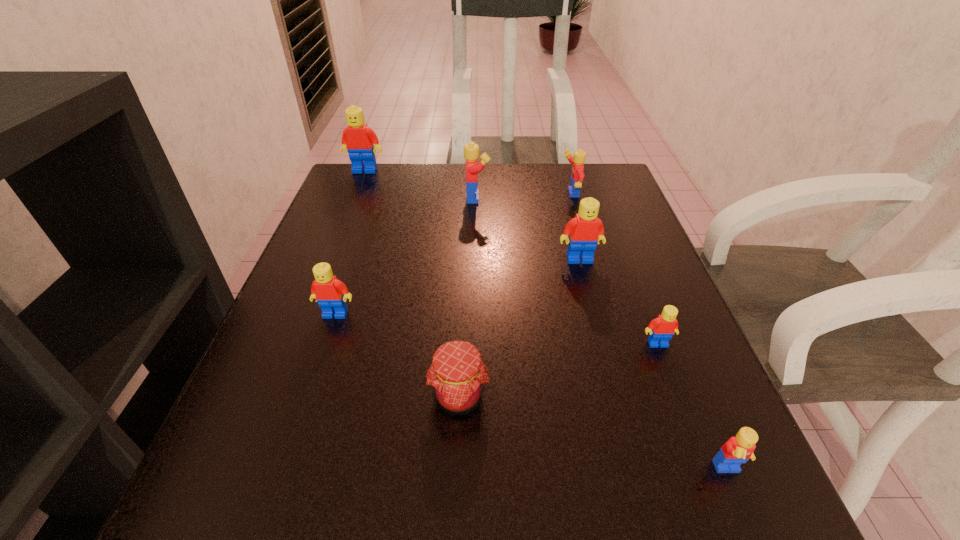
Find the location of `free space located on the face of the second yellow Lego from left to right`. free space located on the face of the second yellow Lego from left to right is located at coordinates click(x=455, y=194).

Find the location of a particular element. The height and width of the screenshot is (540, 960). free space located 0.130m on the face of the fourth nearest object is located at coordinates (314, 379).

Find the location of a particular element. This screenshot has width=960, height=540. vacant space located on the back of the red jam is located at coordinates (461, 345).

Identify the location of vacant region located on the face of the third nearest object. This screenshot has height=540, width=960. (717, 500).

The width and height of the screenshot is (960, 540). Find the location of `object at the near edge`. object at the near edge is located at coordinates (737, 450).

At what (x,y) coordinates should I click in order to perform the action: click on object at the far left corner. Please return your answer as a coordinate pair (x, y). Looking at the image, I should click on (358, 139).

Find the location of a particular element. object positioned at the far right corner is located at coordinates (577, 175).

Where is `object that is positioned at the near right corner`? object that is positioned at the near right corner is located at coordinates (737, 450).

You are a GUI agent. You are given a task and a screenshot of the screen. Output one action in this format:
    pyautogui.click(x=<x>, y=<y>)
    Task: Click on the blank space at the far edge
    The width and height of the screenshot is (960, 540).
    Given the screenshot: What is the action you would take?
    pyautogui.click(x=430, y=174)

Find the location of a particular element. The width and height of the screenshot is (960, 540). vacant area at the left edge of the desktop is located at coordinates (365, 266).